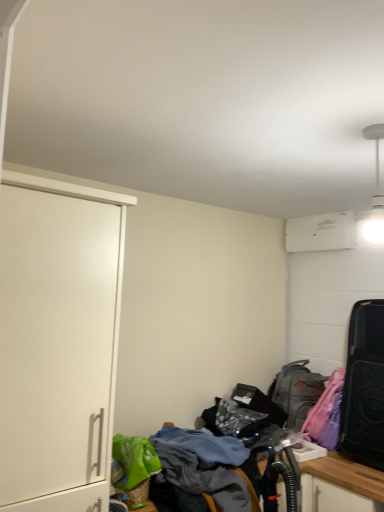
Question: Can you confirm if white matte cabinet at left is smaller than textured fabric desk at lower center?

Choices:
 (A) no
 (B) yes

Answer: (B)

Question: Does white matte cabinet at left lie in front of textured fabric desk at lower center?

Choices:
 (A) no
 (B) yes

Answer: (A)

Question: From the image's perspective, does white matte cabinet at left appear lower than textured fabric desk at lower center?

Choices:
 (A) yes
 (B) no

Answer: (B)

Question: Could you tell me if white matte cabinet at left is turned towards textured fabric desk at lower center?

Choices:
 (A) yes
 (B) no

Answer: (B)

Question: Is white matte cabinet at left to the right of textured fabric desk at lower center from the viewer's perspective?

Choices:
 (A) yes
 (B) no

Answer: (B)

Question: From the image's perspective, is white matte cabinet at left above or below gray fabric backpack at lower right?

Choices:
 (A) below
 (B) above

Answer: (B)

Question: From their relative heights in the image, would you say white matte cabinet at left is taller or shorter than gray fabric backpack at lower right?

Choices:
 (A) short
 (B) tall

Answer: (B)

Question: Is point (76, 231) closer or farther from the camera than point (302, 387)?

Choices:
 (A) closer
 (B) farther

Answer: (A)

Question: From a real-world perspective, is white matte cabinet at left above or below gray fabric backpack at lower right?

Choices:
 (A) below
 (B) above

Answer: (B)

Question: Is black matte suitcase at right taller or shorter than gray fabric backpack at lower right?

Choices:
 (A) tall
 (B) short

Answer: (A)

Question: Does point (380, 315) appear closer or farther from the camera than point (299, 429)?

Choices:
 (A) closer
 (B) farther

Answer: (A)

Question: Considering the positions of black matte suitcase at right and gray fabric backpack at lower right in the image, is black matte suitcase at right bigger or smaller than gray fabric backpack at lower right?

Choices:
 (A) small
 (B) big

Answer: (B)

Question: From a real-world perspective, is black matte suitcase at right physically located above or below gray fabric backpack at lower right?

Choices:
 (A) above
 (B) below

Answer: (A)

Question: From the image's perspective, is gray fabric backpack at lower right located above or below black matte suitcase at right?

Choices:
 (A) below
 (B) above

Answer: (A)

Question: Is gray fabric backpack at lower right in front of or behind black matte suitcase at right in the image?

Choices:
 (A) behind
 (B) front

Answer: (A)